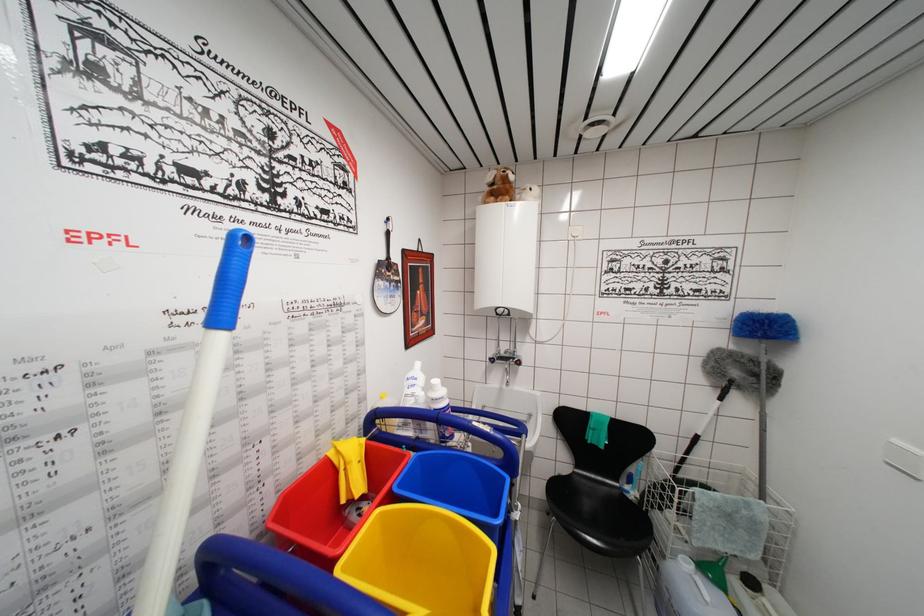
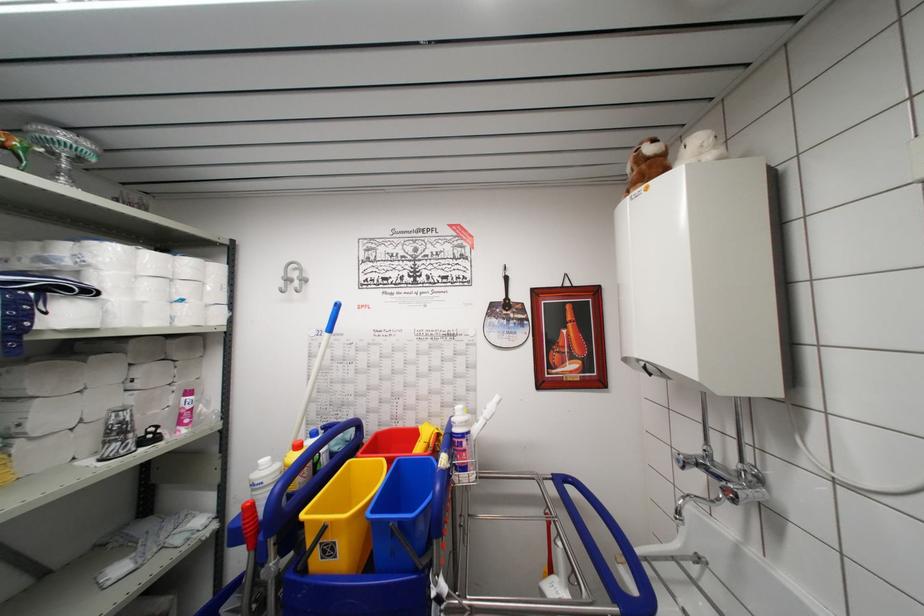
The point at (x=393, y=274) is marked in the first image. Where is the corresponding point in the second image?

(511, 313)